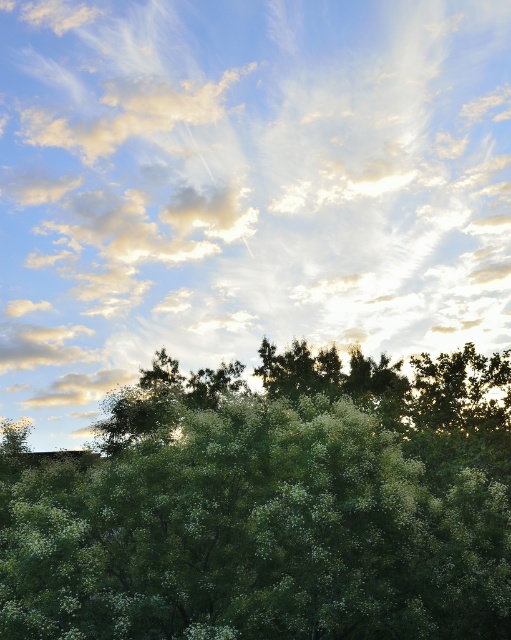
Question: Which point is farther to the camera?

Choices:
 (A) (469, 369)
 (B) (184, 291)

Answer: (B)

Question: Which of the following is the closest to the observer?

Choices:
 (A) green leafy tree at center
 (B) white fluffy cloud at upper center

Answer: (A)

Question: Considering the relative positions of white fluffy cloud at upper center and green leafy tree at center in the image provided, where is white fluffy cloud at upper center located with respect to green leafy tree at center?

Choices:
 (A) right
 (B) left

Answer: (B)

Question: Does white fluffy cloud at upper center have a smaller size compared to green leafy tree at center?

Choices:
 (A) no
 (B) yes

Answer: (A)

Question: Which point is closer to the camera taking this photo?

Choices:
 (A) (77, 246)
 (B) (134, 433)

Answer: (B)

Question: Is white fluffy cloud at upper center bigger than green leafy tree at center?

Choices:
 (A) no
 (B) yes

Answer: (B)